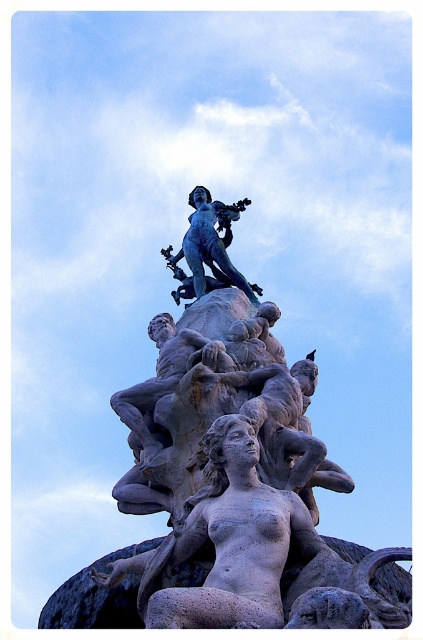
Can you confirm if smooth gray statue at center is smaller than blue patina statue at upper center?

Indeed, smooth gray statue at center has a smaller size compared to blue patina statue at upper center.

The height and width of the screenshot is (640, 423). I want to click on smooth gray statue at center, so click(161, 384).

Identify the location of smooth gray statue at center. This screenshot has height=640, width=423. (161, 384).

Describe the element at coordinates (235, 540) in the screenshot. I see `gray stone statue at center` at that location.

Who is taller, gray stone statue at center or smooth gray statue at center?

Standing taller between the two is smooth gray statue at center.

Is point (235, 579) closer to camera compared to point (208, 355)?

Yes, it is in front of point (208, 355).

Find the location of `gray stone statue at center`. gray stone statue at center is located at coordinates (235, 540).

Based on the photo, is gray stone statue at center above blue patina statue at upper center?

Incorrect, gray stone statue at center is not positioned above blue patina statue at upper center.

Is gray stone statue at center positioned before blue patina statue at upper center?

Yes, gray stone statue at center is in front of blue patina statue at upper center.

The height and width of the screenshot is (640, 423). Find the location of `gray stone statue at center`. gray stone statue at center is located at coordinates (235, 540).